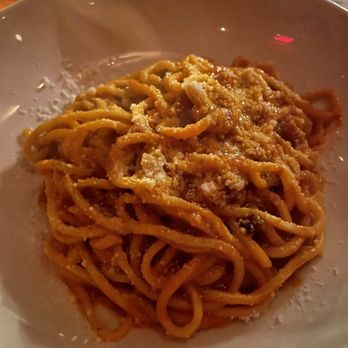
The height and width of the screenshot is (348, 348). Identify the location of illuminated small lights on plate. (20, 36), (4, 17), (91, 4), (74, 336), (62, 334), (84, 343), (340, 160), (338, 132), (15, 106), (40, 85).